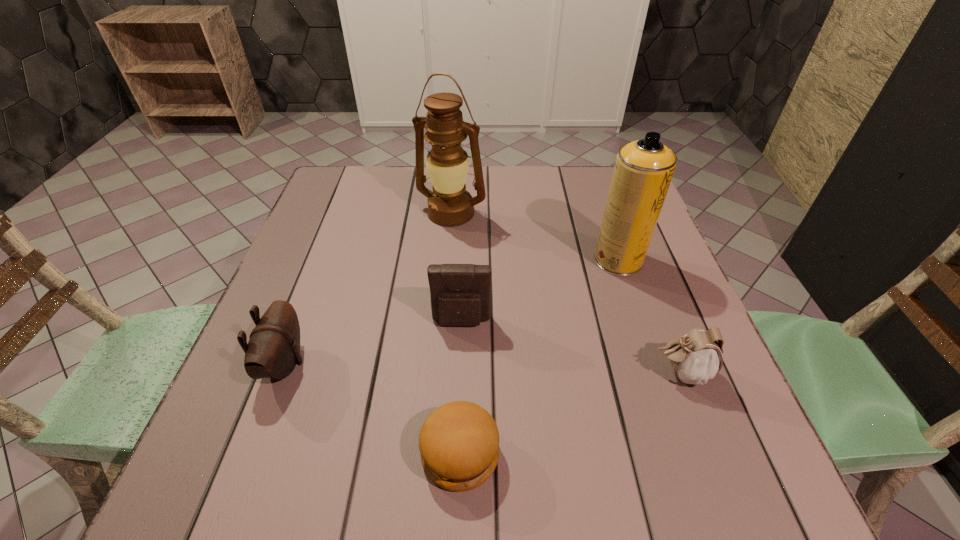
At what (x,y) coordinates should I click in order to perform the action: click on free space between the second farthest object and the rightmost pouch. Please return your answer as a coordinate pair (x, y). This screenshot has width=960, height=540. Looking at the image, I should click on (649, 316).

I want to click on vacant space that is in between the rightmost pouch and the second pouch from left to right, so click(571, 347).

The width and height of the screenshot is (960, 540). Identify the location of object that is the fifth closest to the rightmost pouch. (273, 350).

Identify which object is located as the fourth nearest to the aerosol can. Please provide its 2D coordinates. Your answer should be formatted as a tuple, i.e. [(x, y)], where the tuple contains the x and y coordinates of a point satisfying the conditions above.

[(459, 441)]

Identify which pouch is the second nearest to the third farthest object. Please provide its 2D coordinates. Your answer should be formatted as a tuple, i.e. [(x, y)], where the tuple contains the x and y coordinates of a point satisfying the conditions above.

[(696, 357)]

Where is `the second closest pouch relative to the oil lamp`? the second closest pouch relative to the oil lamp is located at coordinates (273, 350).

At what (x,y) coordinates should I click in order to perform the action: click on free region that satisfies the following two spatial constraints: 1. with the flap open on the leftmost object; 2. on the back side of the shortest object. Please return your answer as a coordinate pair (x, y). The height and width of the screenshot is (540, 960). Looking at the image, I should click on (251, 454).